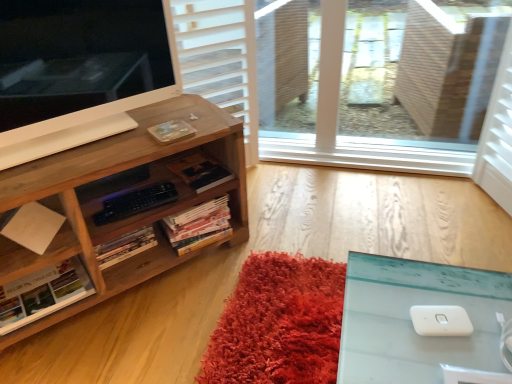
Identify the location of vacant space underneath white glossy computer monitor at upper left (from a real-world perspective). The image size is (512, 384). (103, 126).